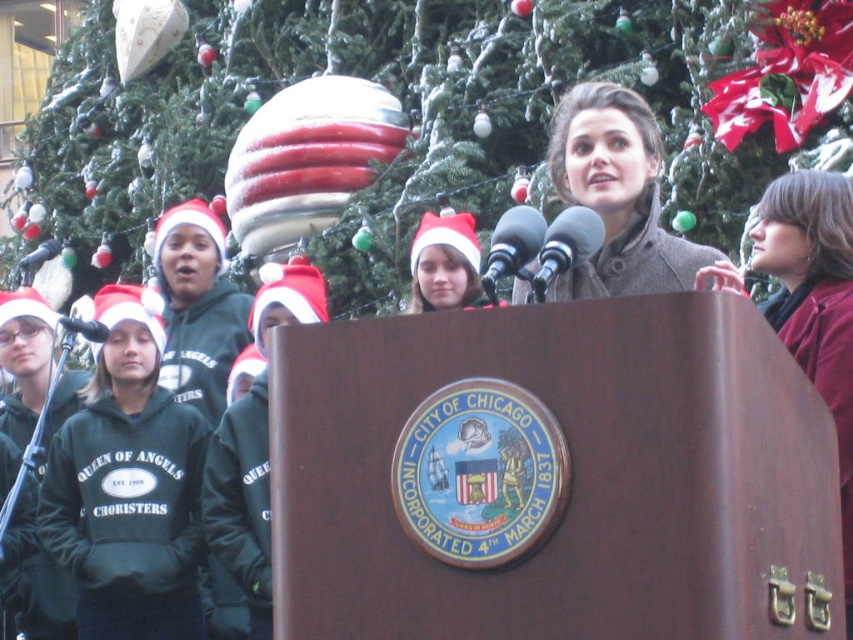
Question: Which of the following is the closest to the observer?

Choices:
 (A) (97, 340)
 (B) (445, 298)
 (C) (518, 218)

Answer: (C)

Question: Does matte white santa hat at center appear over metallic gray microphone at center?

Choices:
 (A) yes
 (B) no

Answer: (B)

Question: Can you confirm if green fleece sweatshirt at left is wider than gray wool coat at center?

Choices:
 (A) no
 (B) yes

Answer: (B)

Question: Which point is farther from the camera taking this photo?

Choices:
 (A) (154, 198)
 (B) (689, 284)

Answer: (A)

Question: Is green fleece sweatshirt at left positioned before black matte microphone at center?

Choices:
 (A) yes
 (B) no

Answer: (B)

Question: Which point is closer to the camera?

Choices:
 (A) (595, 221)
 (B) (669, 246)
 (C) (109, 548)

Answer: (A)